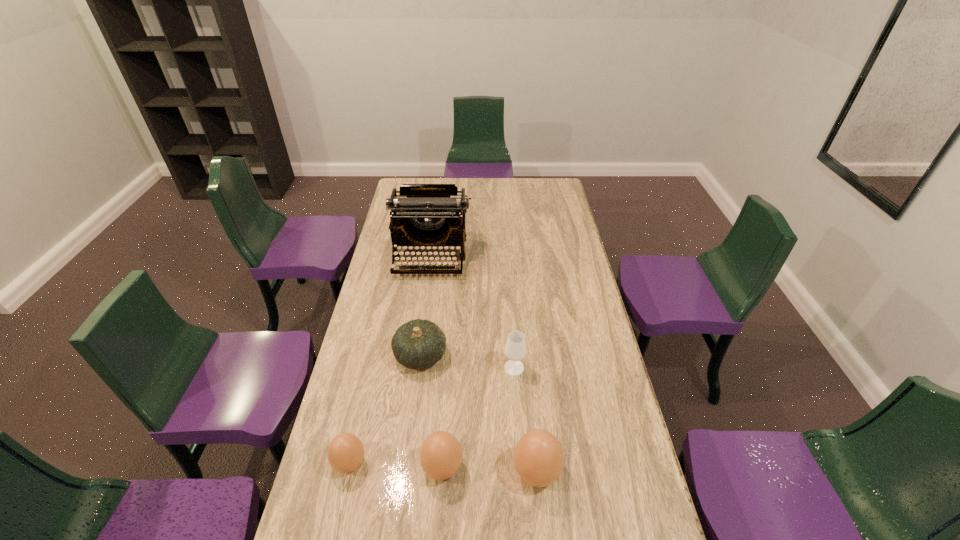
Identify the location of blank space located on the left of the rightmost boiled egg. (426, 472).

This screenshot has width=960, height=540. I want to click on free space located 0.290m on the typing side of the farthest object, so click(420, 332).

This screenshot has height=540, width=960. Identify the location of vacant area located 0.390m on the back of the glass. (508, 284).

The height and width of the screenshot is (540, 960). I want to click on vacant space located on the right of the gourd, so click(502, 355).

Where is `boiled egg situated at the left edge`? This screenshot has width=960, height=540. boiled egg situated at the left edge is located at coordinates (345, 453).

Identify the location of typewriter located at the left edge. Image resolution: width=960 pixels, height=540 pixels. pyautogui.click(x=423, y=215).

Locate an element on the screen. gourd that is at the left edge is located at coordinates (418, 344).

The image size is (960, 540). I want to click on free space at the far edge, so click(x=488, y=182).

You are a GUI agent. You are given a task and a screenshot of the screen. Output one action in this format:
    pyautogui.click(x=<x>, y=<y>)
    Task: Click on the free point at the near edge
    
    Given the screenshot: What is the action you would take?
    pyautogui.click(x=564, y=525)

Image resolution: width=960 pixels, height=540 pixels. I want to click on free region at the right edge of the desktop, so click(x=595, y=330).